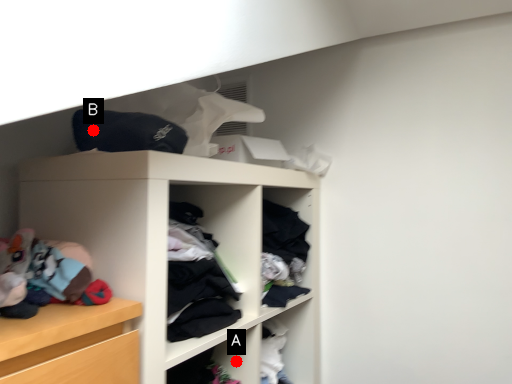
Question: Two points are circled on the image, labeled by A and B beside each circle. Among these points, which one is farthest from the camera?

Choices:
 (A) A is further
 (B) B is further

Answer: (A)